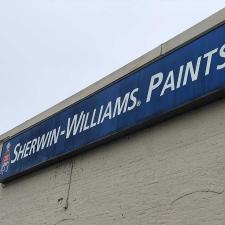
The width and height of the screenshot is (225, 225). I want to click on black metal sign holder, so click(121, 133).